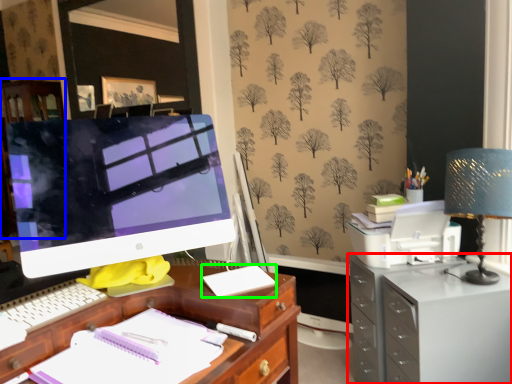
Question: Based on their relative distances, which object is farther from filing cabinet (highlighted by a red box)? Choose from dresser (highlighted by a blue box) and office supplies (highlighted by a green box).

Choices:
 (A) dresser
 (B) office supplies

Answer: (A)